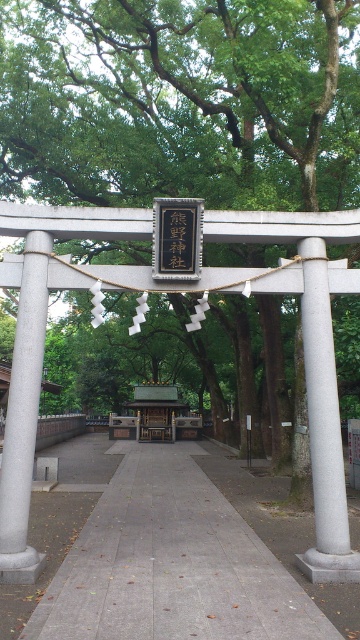
Is green leafy tree at center further to the viewer compared to black paper at center?

That is True.

Who is lower down, green leafy tree at center or black paper at center?

black paper at center

Where is `green leafy tree at center`? This screenshot has width=360, height=640. green leafy tree at center is located at coordinates (181, 100).

Between point (15, 554) and point (180, 260), which one is positioned behind?

Point (180, 260)

Is gray concrete post at left wider than black paper at center?

Indeed, gray concrete post at left has a greater width compared to black paper at center.

Is point (0, 524) farther from camera compared to point (178, 241)?

No, it is in front of (178, 241).

Identify the location of gray concrete post at left. The height and width of the screenshot is (640, 360). (24, 416).

Consider the image. Can you confirm if green leafy tree at center is thinner than white stone pillar at right?

Incorrect, green leafy tree at center's width is not less than white stone pillar at right's.

Does point (118, 173) lie behind point (330, 458)?

Yes, it is behind point (330, 458).

Where is `green leafy tree at center`? This screenshot has width=360, height=640. green leafy tree at center is located at coordinates (181, 100).

Identify the location of green leafy tree at center. This screenshot has width=360, height=640. (181, 100).